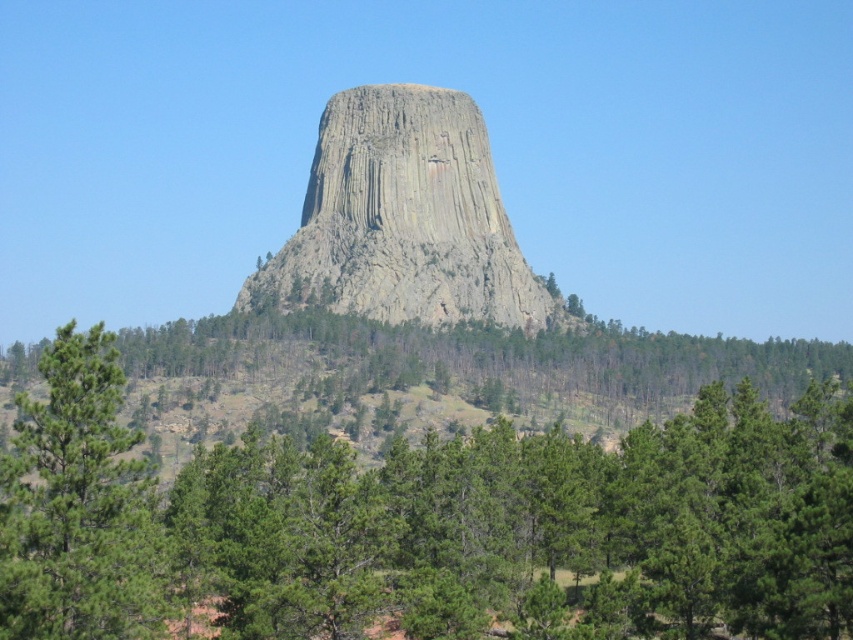
You are standing at the base of Devils Tower and want to take a photo that includes both the tower and a green leafy tree at center. Based on the coordinates provided, will the tree at point (x=427, y=524) be visible in the photo if you position yourself to capture the tower?

The green leafy tree at center is represented by point (x=427, y=524), so yes, positioning yourself to capture Devils Tower will include the tree at that coordinate in the photo since they are both within the same frame.

You are a photographer planning to capture the Devils Tower with both the green leafy tree at center and the gray rock formation at center in your shot. Based on their widths, which object would occupy more space horizontally in the photo?

The green leafy tree at center has a greater width than the gray rock formation at center, so it would occupy more horizontal space in the photo.